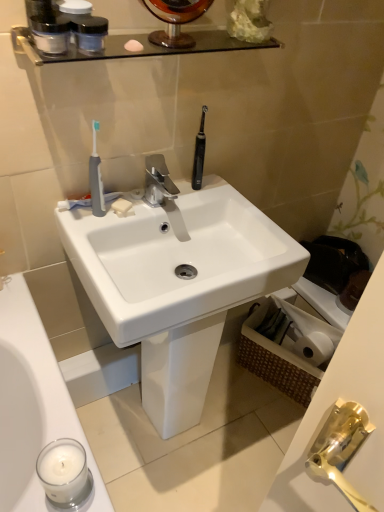
I want to click on vacant space in white glossy sink at center (from a real-world perspective), so tap(182, 428).